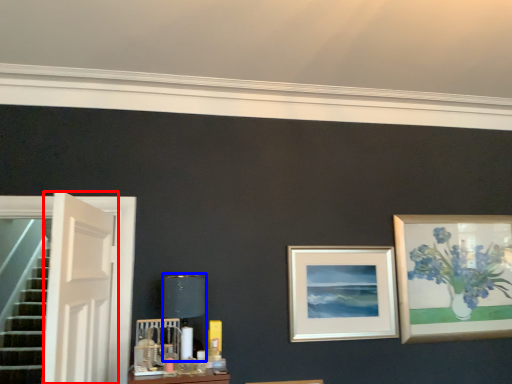
Question: Which of the following is the closest to the observer, door (highlighted by a red box) or table lamp (highlighted by a blue box)?

Choices:
 (A) door
 (B) table lamp

Answer: (A)